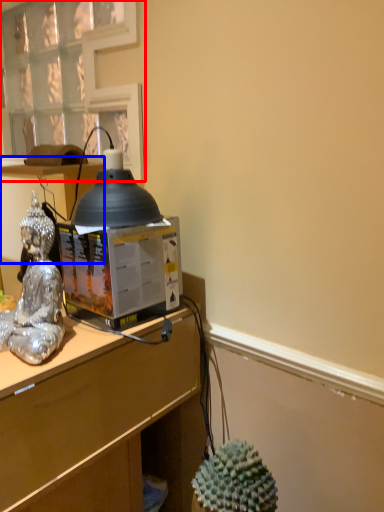
Question: Which of the following is the farthest to the observer, window (highlighted by a red box) or vanity (highlighted by a blue box)?

Choices:
 (A) window
 (B) vanity

Answer: (A)